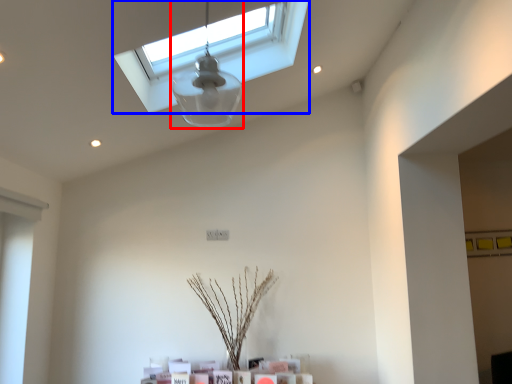
Question: Which object appears closest to the camera in this image, lamp (highlighted by a red box) or window (highlighted by a blue box)?

Choices:
 (A) lamp
 (B) window

Answer: (A)